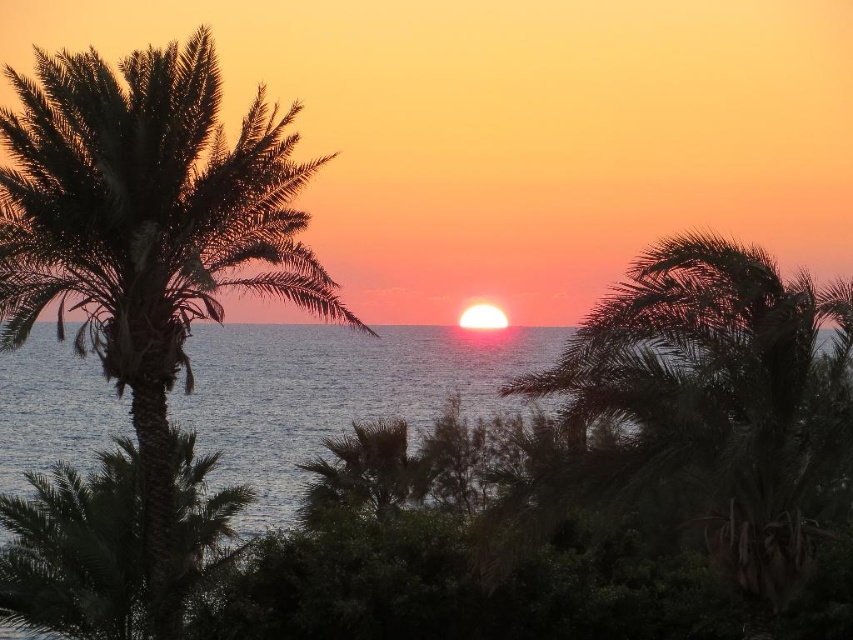
Between green leafy palm tree at center and blue water at center, which one appears on the left side from the viewer's perspective?

blue water at center

Who is higher up, green leafy palm tree at center or blue water at center?

green leafy palm tree at center

Measure the distance between point (740, 317) and camera.

Point (740, 317) and camera are 13.80 meters apart.

Locate an element on the screen. Image resolution: width=853 pixels, height=640 pixels. green leafy palm tree at center is located at coordinates (711, 403).

Between point (181, 230) and point (131, 493), which one is positioned in front?

Point (181, 230)

Can you confirm if silhouette leafy palm at left is smaller than green leafy palm tree at left?

Yes, silhouette leafy palm at left is smaller than green leafy palm tree at left.

Is point (289, 285) closer to camera compared to point (102, 529)?

Yes, it is.

Locate an element on the screen. This screenshot has width=853, height=640. silhouette leafy palm at left is located at coordinates (148, 234).

Is point (125, 385) more distant than point (676, 449)?

Yes.

Does silhouette leafy palm at left have a larger size compared to green leafy palm tree at center?

Correct, silhouette leafy palm at left is larger in size than green leafy palm tree at center.

I want to click on silhouette leafy palm at left, so click(148, 234).